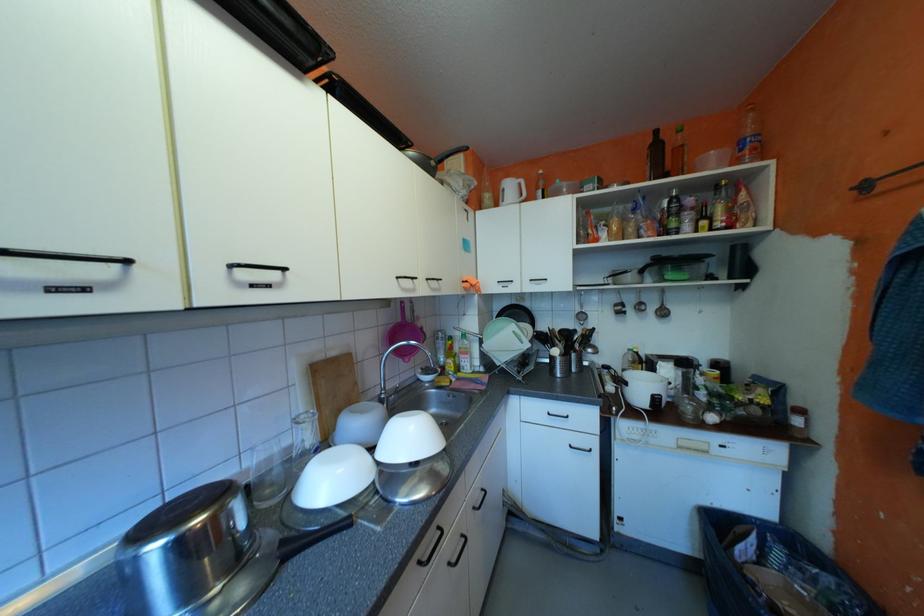
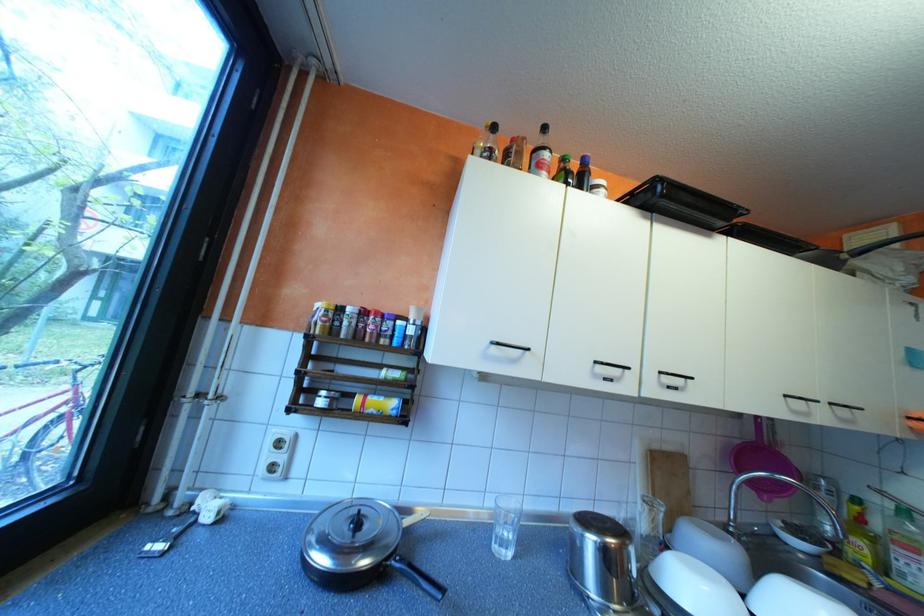
The point at (439,278) is marked in the first image. Where is the corresponding point in the second image?

(843, 403)